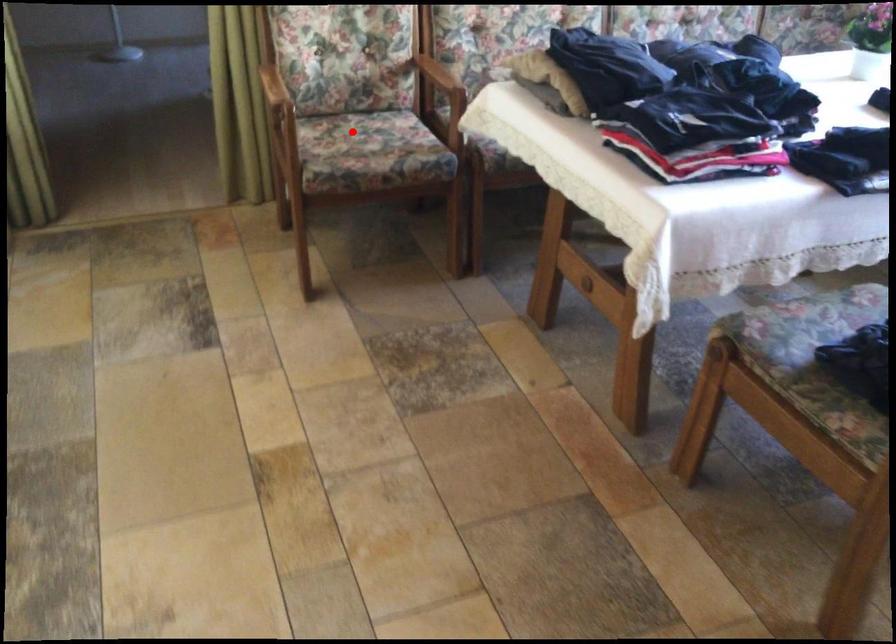
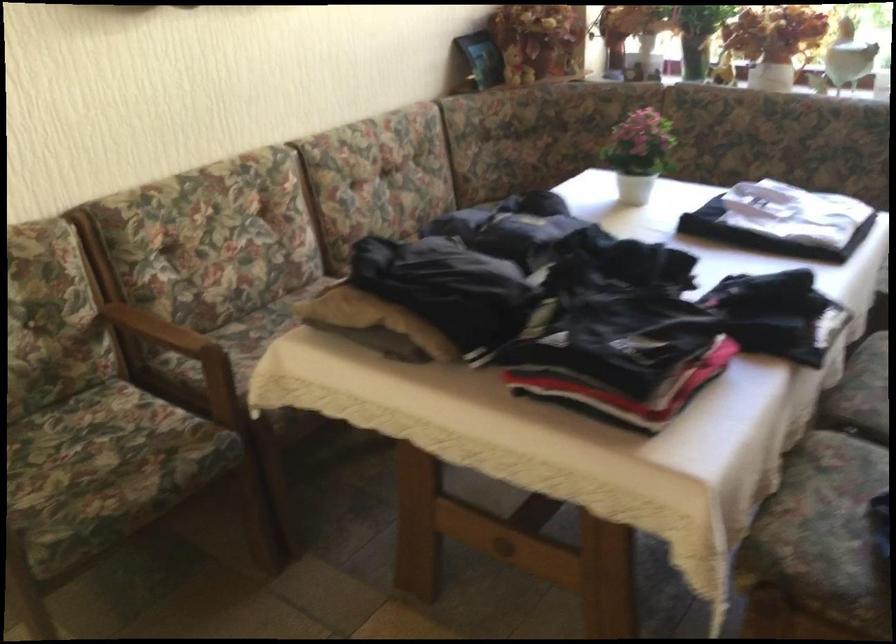
In the second image, find the point that corresponds to the highlighted location in the first image.

(67, 444)